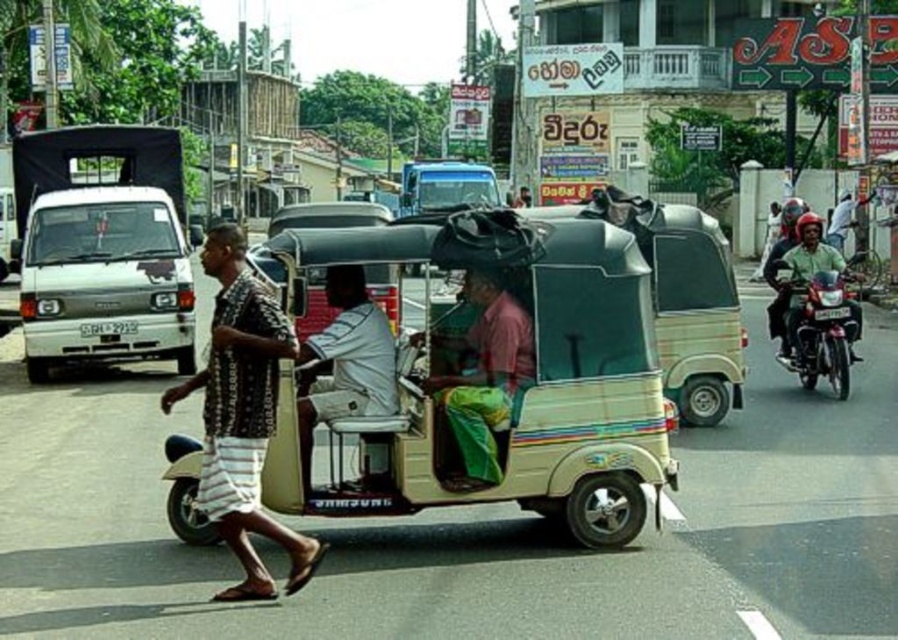
Does brown printed shirt at center lie behind shiny metallic motorcycle at right?

No, brown printed shirt at center is in front of shiny metallic motorcycle at right.

Can you confirm if brown printed shirt at center is smaller than shiny metallic motorcycle at right?

Correct, brown printed shirt at center occupies less space than shiny metallic motorcycle at right.

Measure the distance between brown printed shirt at center and camera.

brown printed shirt at center is 6.04 meters from camera.

Identify the location of brown printed shirt at center. (242, 416).

Is point (113, 216) positioned in front of point (208, 416)?

No, (113, 216) is behind (208, 416).

Who is positioned more to the left, white matte van at left or brown printed shirt at center?

white matte van at left is more to the left.

The height and width of the screenshot is (640, 898). In order to click on white matte van at left in this screenshot , I will do `click(104, 280)`.

Does beige plastic tricycle at center have a lesser height compared to white matte van at left?

Yes, beige plastic tricycle at center is shorter than white matte van at left.

The image size is (898, 640). Describe the element at coordinates (490, 380) in the screenshot. I see `beige plastic tricycle at center` at that location.

Locate an element on the screen. This screenshot has width=898, height=640. beige plastic tricycle at center is located at coordinates (490, 380).